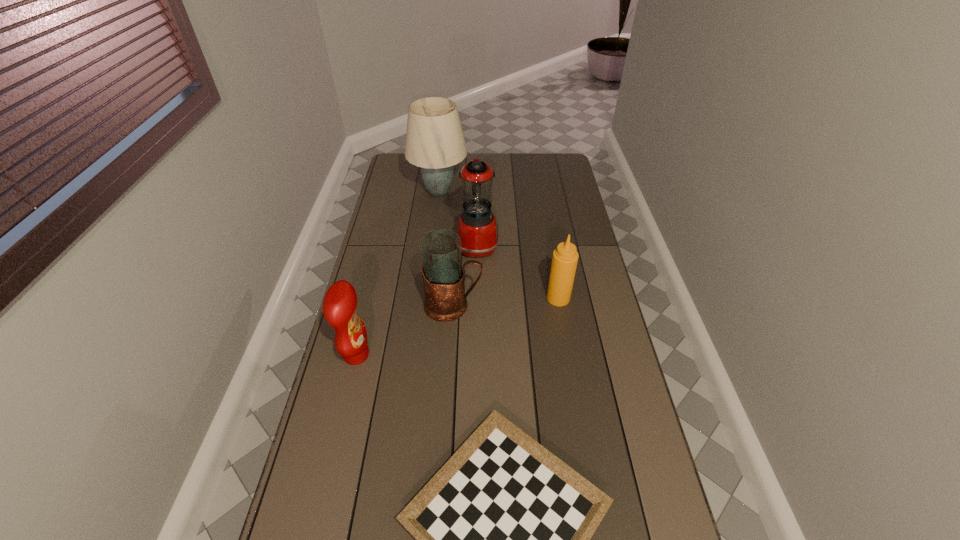
At what (x,y) coordinates should I click in order to perform the action: click on vacant region between the pitcher and the nearer condiment. Please return your answer as a coordinate pair (x, y). Looking at the image, I should click on (405, 330).

Identify the location of free space between the food processor and the right condiment. This screenshot has width=960, height=540. (517, 272).

At what (x,y) coordinates should I click in order to perform the action: click on vacant area that lies between the left condiment and the farther condiment. Please return your answer as a coordinate pair (x, y). The image size is (960, 540). Looking at the image, I should click on (457, 327).

Identify the location of unoccupied position between the pitcher and the second farthest object. This screenshot has height=540, width=960. (466, 276).

Identify the location of free point between the farthest object and the fifth farthest object. (397, 273).

Find the location of a particular element. The width and height of the screenshot is (960, 540). object that ranks as the fourth closest to the pitcher is located at coordinates (503, 529).

Locate which object ranks fourth in proximity to the pitcher. Please provide its 2D coordinates. Your answer should be formatted as a tuple, i.e. [(x, y)], where the tuple contains the x and y coordinates of a point satisfying the conditions above.

[(503, 529)]

You are a GUI agent. You are given a task and a screenshot of the screen. Output one action in this format:
    pyautogui.click(x=<x>, y=<y>)
    Task: Click on the vacant position in the image that satisfies the following two spatial constraints: 1. on the controls of the right condiment; 2. on the left side of the fifth nearest object
    Image resolution: width=960 pixels, height=540 pixels.
    Given the screenshot: What is the action you would take?
    pyautogui.click(x=477, y=298)

Locate an element on the screen. free region that satisfies the following two spatial constraints: 1. on the front side of the farther condiment; 2. on the label side of the left condiment is located at coordinates (568, 355).